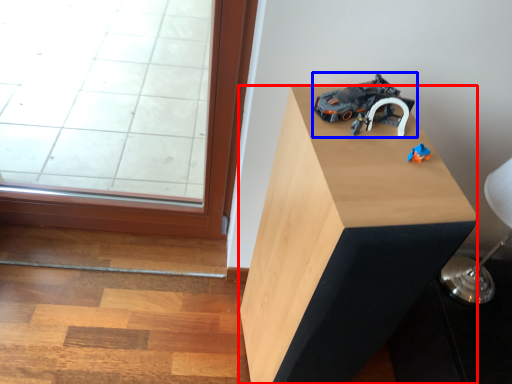
Question: Which object is closer to the camera taking this photo, furniture (highlighted by a red box) or toy (highlighted by a blue box)?

Choices:
 (A) furniture
 (B) toy

Answer: (A)